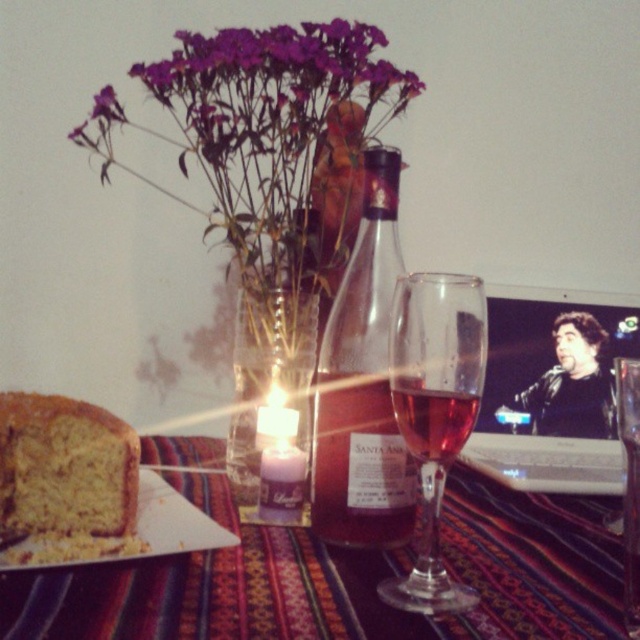
You are a delivery person who needs to place a small package on the table without knocking over any items. The package is 15 centimeters wide. Is there enough space between the matte glass bottle at center and the edge of the table to safely place the package?

The distance between the matte glass bottle at center and the viewer is 38.23 centimeters, but this measurement does not directly indicate the available space on the table. Without knowing the table edge proximity, it is uncertain if the 15 cm package can fit safely.

You are hosting a dinner party and need to pour drinks for your guests. You have a matte glass bottle at center and a translucent glass Santa Ana wine at center on the table. Which container can hold more liquid?

The matte glass bottle at center has a larger size compared to the translucent glass Santa Ana wine at center, so it can hold more liquid.

You are setting up a centerpiece for a dinner party and have a matte glass bottle at center and a pink glass at center on the table. Which object has a greater width?

The matte glass bottle at center has a greater width than the pink glass at center according to the description.